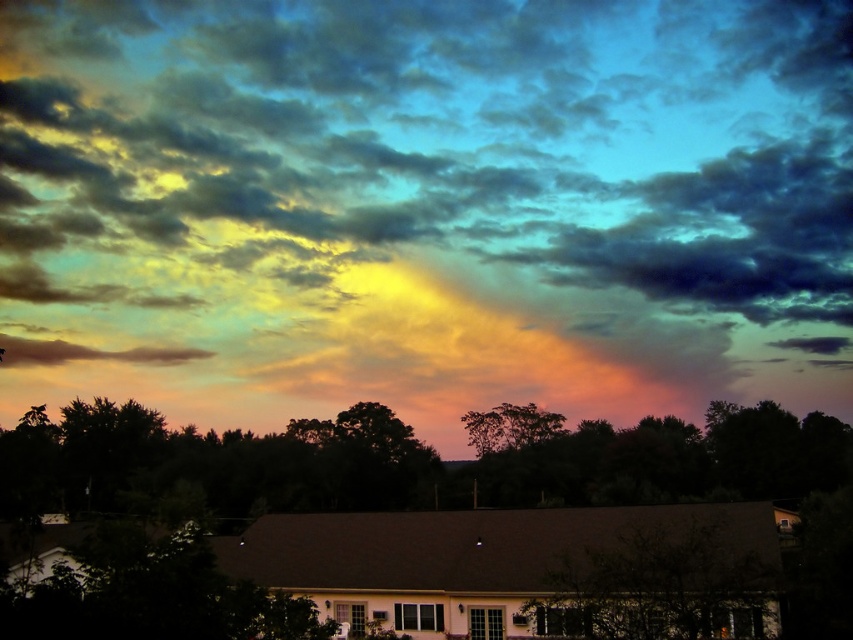
Describe the element at coordinates (428, 205) in the screenshot. I see `cloudy sky at upper center` at that location.

Who is more distant from viewer, (518,342) or (26,364)?

The point (26,364) is more distant.

Between point (35, 218) and point (77, 355), which one is positioned behind?

Point (35, 218)

You are a GUI agent. You are given a task and a screenshot of the screen. Output one action in this format:
    pyautogui.click(x=<x>, y=<y>)
    Task: Click on the cloudy sky at upper center
    The image size is (853, 640).
    Given the screenshot: What is the action you would take?
    pyautogui.click(x=428, y=205)

Does cloudy sky at upper center have a larger size compared to silhouette leafy tree at center?

Yes, cloudy sky at upper center is bigger than silhouette leafy tree at center.

Find the location of a particular element. cloudy sky at upper center is located at coordinates 428,205.

Does green leafy tree at lower center appear over matte brown cloud at lower left?

Yes, green leafy tree at lower center is above matte brown cloud at lower left.

Between green leafy tree at lower center and matte brown cloud at lower left, which one is positioned lower?

matte brown cloud at lower left

Does point (695, 518) come farther from viewer compared to point (39, 362)?

No, (695, 518) is in front of (39, 362).

At what (x,y) coordinates should I click in order to perform the action: click on green leafy tree at lower center. Please return your answer as a coordinate pair (x, y). The width and height of the screenshot is (853, 640). Looking at the image, I should click on (660, 586).